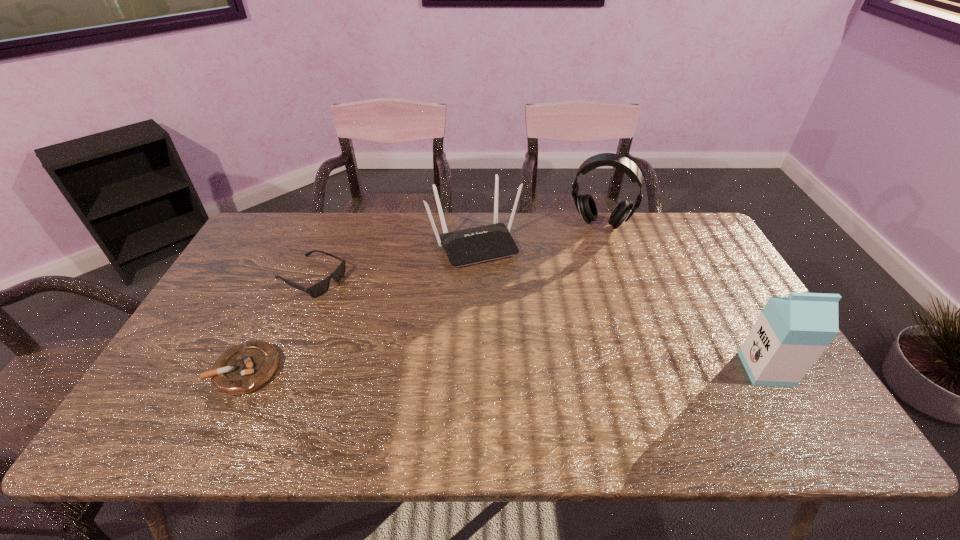
At what (x,y) coordinates should I click in order to perform the action: click on milk carton situated at the near edge. Please return your answer as a coordinate pair (x, y). This screenshot has height=540, width=960. Looking at the image, I should click on (790, 334).

This screenshot has width=960, height=540. What are the coordinates of `ashtray present at the left edge` in the screenshot? It's located at (244, 368).

Identify the location of sunglasses present at the left edge. (316, 290).

You are a GUI agent. You are given a task and a screenshot of the screen. Output one action in this format:
    pyautogui.click(x=<x>, y=<y>)
    Task: Click on the object located at the right edge
    
    Given the screenshot: What is the action you would take?
    pyautogui.click(x=790, y=334)

The height and width of the screenshot is (540, 960). I want to click on object that is at the near left corner, so click(244, 368).

Identify the location of object positioned at the near right corner. (790, 334).

Locate an element on the screen. This screenshot has height=540, width=960. free space at the far edge is located at coordinates (419, 219).

This screenshot has height=540, width=960. I want to click on vacant area at the near edge, so click(x=468, y=398).

In order to click on vacant space at the left edge in this screenshot , I will do `click(251, 256)`.

What are the coordinates of `free space at the right edge of the desktop` in the screenshot? It's located at (718, 322).